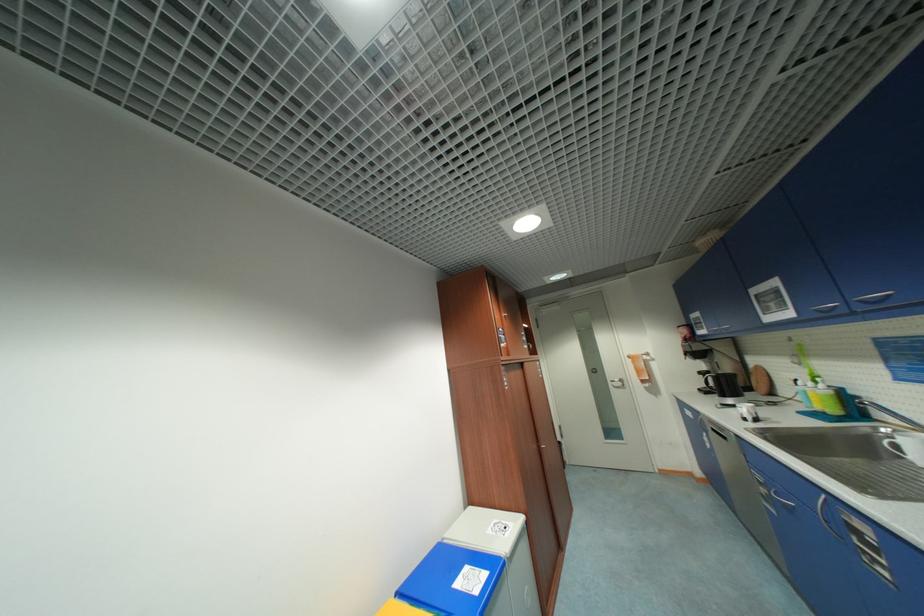
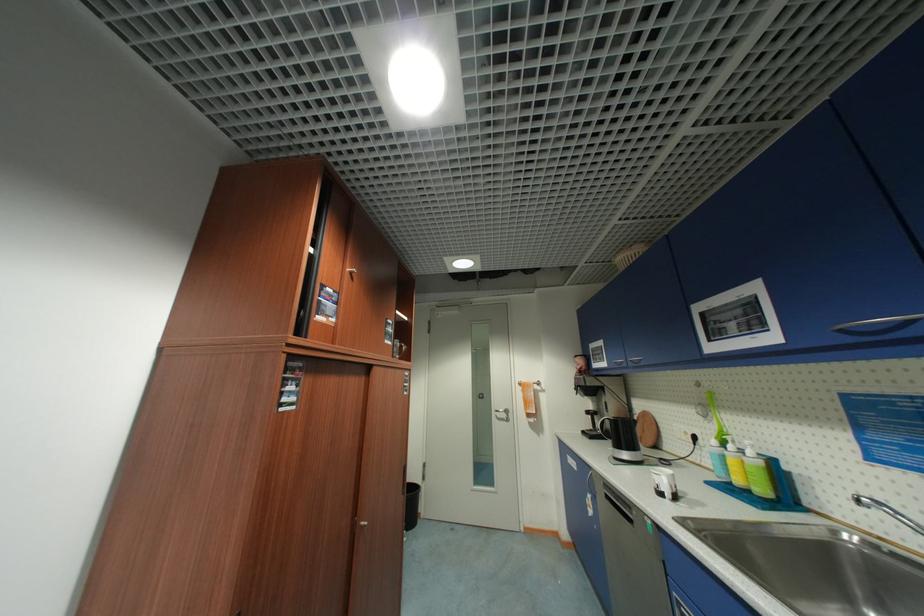
Find the pixel in the second image that matches pixel 827 387 in the first image.

(756, 454)